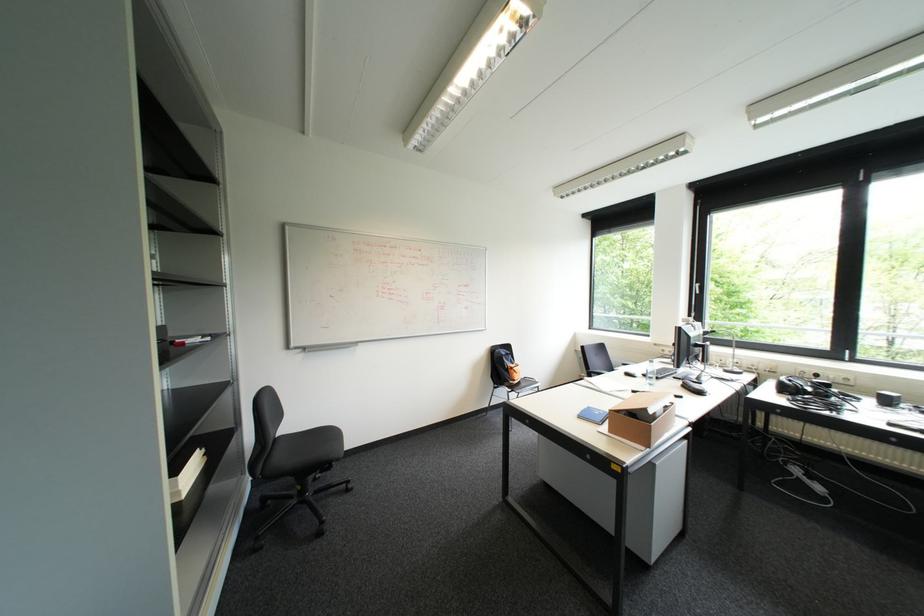
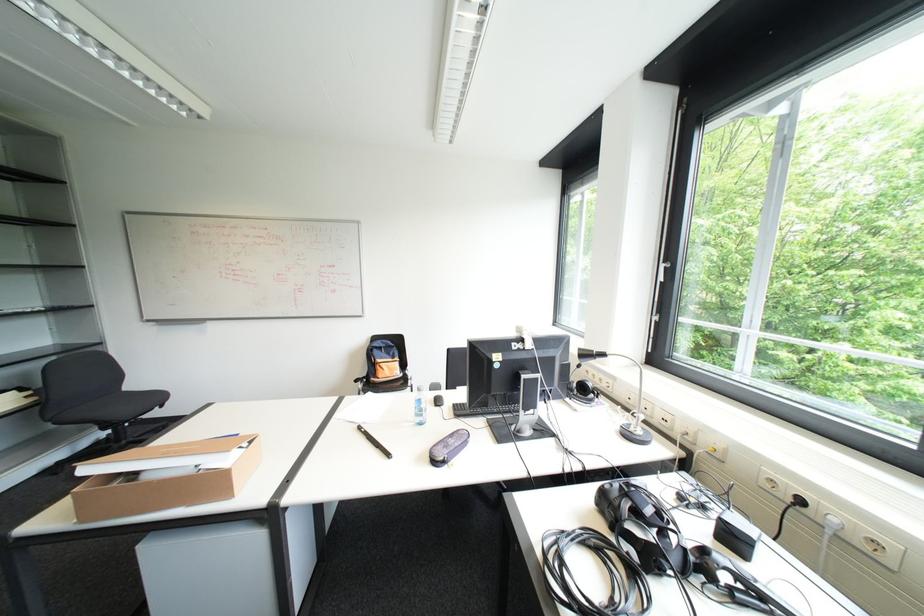
Which direction would the cameraman need to move to produce the second image?

The cameraman moved toward right, forward.